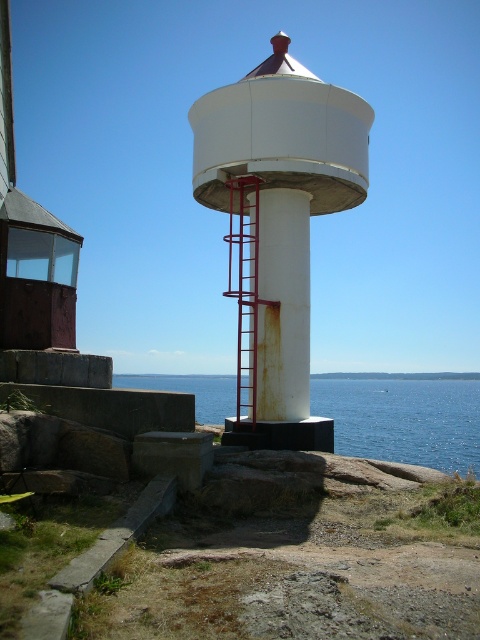
Does rusty metal pillar at center lie behind metallic red ladder at center?

Yes, it is.

Which is above, rusty metal pillar at center or metallic red ladder at center?

Positioned higher is rusty metal pillar at center.

Does point (286, 384) come in front of point (238, 196)?

Yes, point (286, 384) is closer to viewer.

The width and height of the screenshot is (480, 640). Identify the location of rusty metal pillar at center. (283, 305).

Is point (286, 406) less distant than point (275, 323)?

Yes, it is in front of point (275, 323).

Which is below, white matte water tower at center or rusty metal pillar at center?

rusty metal pillar at center is lower down.

Is point (263, 422) positioned after point (261, 358)?

No, it is not.

Where is `white matte water tower at center`? The height and width of the screenshot is (640, 480). white matte water tower at center is located at coordinates (277, 225).

Can you confirm if white matte water tower at center is positioned above metallic red ladder at center?

Indeed, white matte water tower at center is positioned over metallic red ladder at center.

Between white matte water tower at center and metallic red ladder at center, which one is positioned lower?

Positioned lower is metallic red ladder at center.

Image resolution: width=480 pixels, height=640 pixels. Identify the location of white matte water tower at center. (x=277, y=225).